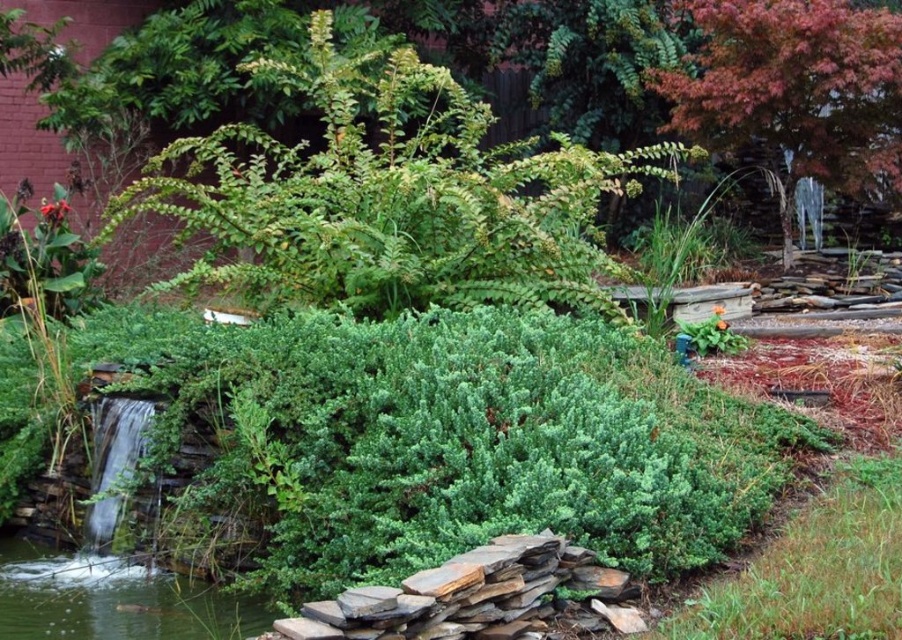
In the scene shown: Does green leafy bush at upper center have a larger size compared to clear water at lower left?

No.

The height and width of the screenshot is (640, 902). Describe the element at coordinates (388, 196) in the screenshot. I see `green leafy bush at upper center` at that location.

Who is more forward, (x=453, y=218) or (x=91, y=620)?

Point (x=91, y=620)

In order to click on green leafy bush at upper center in this screenshot , I will do `click(388, 196)`.

Does green leafy bush at upper center have a greater height compared to reddish-brown textured tree at upper right?

Incorrect, green leafy bush at upper center's height is not larger of reddish-brown textured tree at upper right's.

Between green leafy bush at upper center and reddish-brown textured tree at upper right, which one appears on the left side from the viewer's perspective?

Positioned to the left is green leafy bush at upper center.

This screenshot has width=902, height=640. Describe the element at coordinates (388, 196) in the screenshot. I see `green leafy bush at upper center` at that location.

This screenshot has width=902, height=640. I want to click on green leafy bush at upper center, so click(388, 196).

Who is lower down, reddish-brown textured tree at upper right or clear water at lower left?

clear water at lower left is below.

Does reddish-brown textured tree at upper right have a greater height compared to clear water at lower left?

Yes, reddish-brown textured tree at upper right is taller than clear water at lower left.

Is point (723, 81) positioned in front of point (265, 612)?

No, it is behind (265, 612).

Image resolution: width=902 pixels, height=640 pixels. In order to click on reddish-brown textured tree at upper right in this screenshot , I will do `click(796, 90)`.